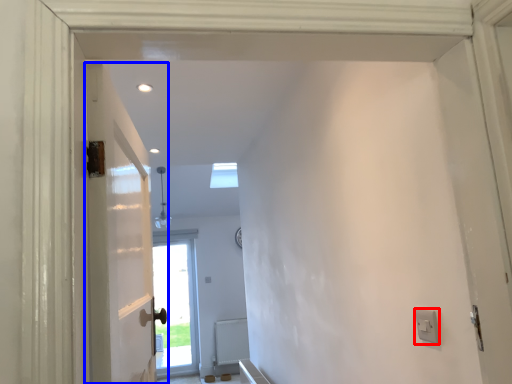
Question: Among these objects, which one is farthest to the camera, electric outlet (highlighted by a red box) or door (highlighted by a blue box)?

Choices:
 (A) electric outlet
 (B) door

Answer: (A)